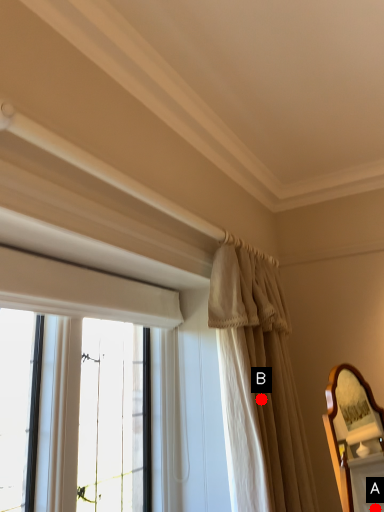
Question: Two points are circled on the image, labeled by A and B beside each circle. Which point is farther to the camera?

Choices:
 (A) A is further
 (B) B is further

Answer: (A)